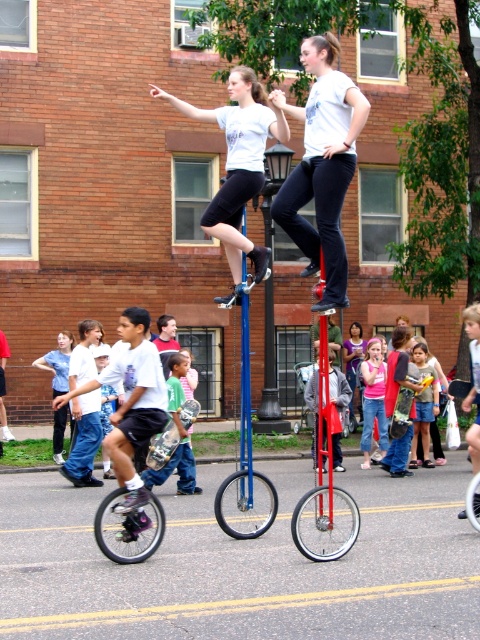
Question: Can you confirm if white cotton shirt at center is smaller than shiny metallic unicycle at lower left?

Choices:
 (A) no
 (B) yes

Answer: (A)

Question: Can you confirm if white t-shirt at lower left is positioned to the right of denim shorts at center?

Choices:
 (A) yes
 (B) no

Answer: (B)

Question: Which point appears closest to the camera in this image?

Choices:
 (A) (427, 444)
 (B) (120, 449)

Answer: (B)

Question: Does matte white t-shirt at center appear on the left side of brushed metal skateboard at lower left?

Choices:
 (A) no
 (B) yes

Answer: (B)

Question: Which object is farther from the camera taking this photo?

Choices:
 (A) white t-shirt at lower left
 (B) denim shorts at center

Answer: (A)

Question: Which point is closer to the camera?

Choices:
 (A) matte white t-shirt at upper center
 (B) white t-shirt at lower left
 (C) white cotton shirt at center
 (D) brushed metal skateboard at lower left

Answer: (C)